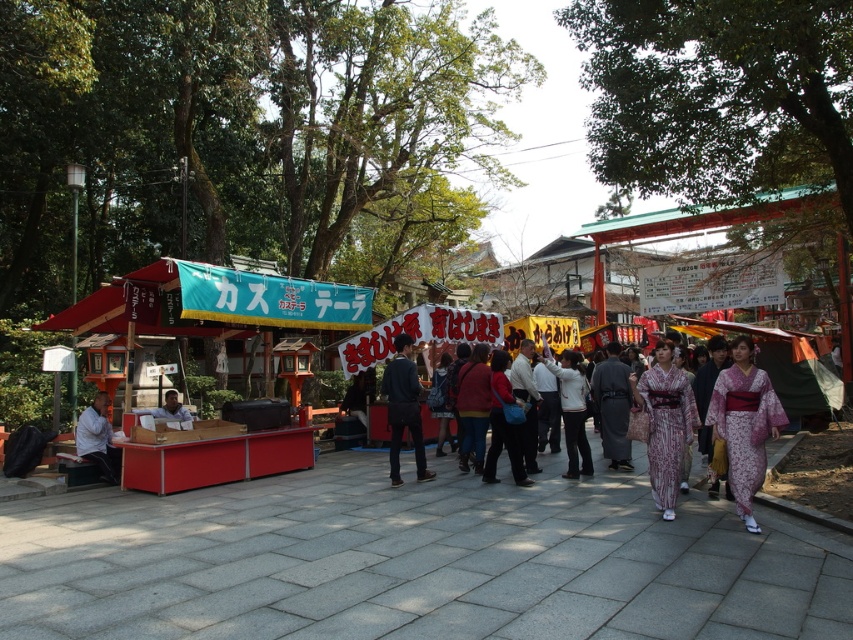
Which is below, dark blue fabric jacket at center or matte white vendor at lower left?

matte white vendor at lower left is below.

Is point (387, 364) closer to viewer compared to point (74, 444)?

No, it is behind (74, 444).

You are a GUI agent. You are given a task and a screenshot of the screen. Output one action in this format:
    pyautogui.click(x=<x>, y=<y>)
    Task: Click on the dark blue fabric jacket at center
    This screenshot has width=853, height=640.
    Given the screenshot: What is the action you would take?
    pyautogui.click(x=403, y=406)

Which of these two, patterned kimono at center or purple floral kimono at center, stands shorter?

purple floral kimono at center

At what (x,y) coordinates should I click in order to perform the action: click on patterned kimono at center. Please return your answer as a coordinate pair (x, y). Looking at the image, I should click on (709, 424).

Who is positioned more to the right, purple floral kimono at center or dark blue fabric jacket at center?

From the viewer's perspective, purple floral kimono at center appears more on the right side.

Is point (751, 484) behind point (395, 339)?

No.

Identify the location of purple floral kimono at center. (744, 424).